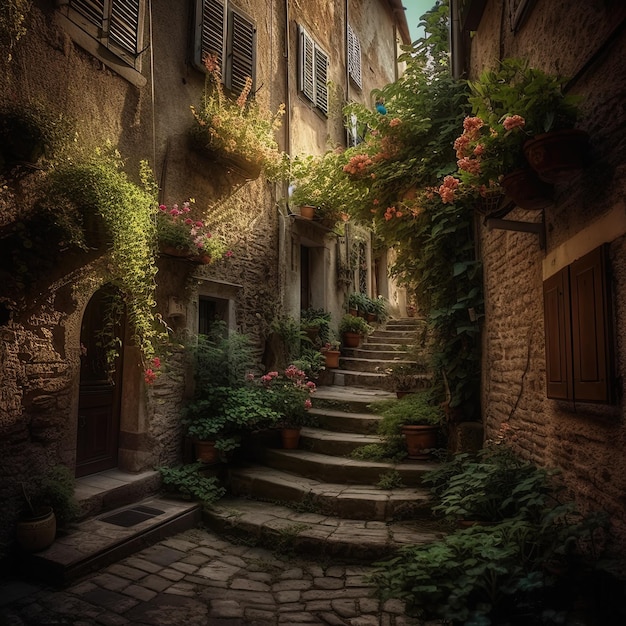
You are a GUI agent. You are given a task and a screenshot of the screen. Output one action in this format:
    pyautogui.click(x=<x>, y=<y>)
    Task: Click on the stairs
    The image size is (626, 626).
    Given the screenshot: What is the action you would take?
    point(352,433)